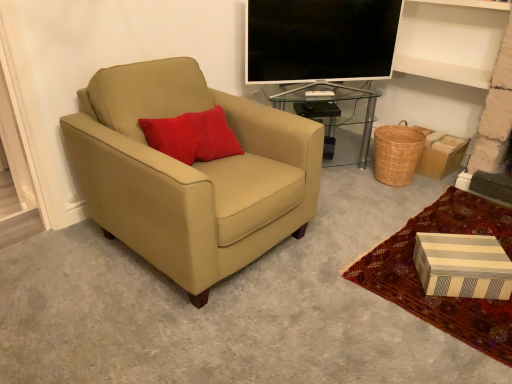
Question: Is flat screen tv at upper center positioned with its back to transparent glass table at center?

Choices:
 (A) no
 (B) yes

Answer: (A)

Question: From the image's perspective, is flat screen tv at upper center over transparent glass table at center?

Choices:
 (A) no
 (B) yes

Answer: (B)

Question: Considering the relative positions of flat screen tv at upper center and transparent glass table at center in the image provided, is flat screen tv at upper center to the right of transparent glass table at center from the viewer's perspective?

Choices:
 (A) yes
 (B) no

Answer: (A)

Question: Would you say flat screen tv at upper center contains transparent glass table at center?

Choices:
 (A) no
 (B) yes

Answer: (A)

Question: Considering the relative positions of flat screen tv at upper center and transparent glass table at center in the image provided, is flat screen tv at upper center to the left of transparent glass table at center from the viewer's perspective?

Choices:
 (A) no
 (B) yes

Answer: (A)

Question: Is flat screen tv at upper center taller or shorter than striped cardboard box at lower right?

Choices:
 (A) short
 (B) tall

Answer: (B)

Question: In terms of width, does flat screen tv at upper center look wider or thinner when compared to striped cardboard box at lower right?

Choices:
 (A) thin
 (B) wide

Answer: (A)

Question: From a real-world perspective, is flat screen tv at upper center physically located above or below striped cardboard box at lower right?

Choices:
 (A) below
 (B) above

Answer: (B)

Question: From the image's perspective, relative to striped cardboard box at lower right, is flat screen tv at upper center above or below?

Choices:
 (A) above
 (B) below

Answer: (A)

Question: In the image, is transparent glass table at center positioned in front of or behind striped cardboard box at lower right?

Choices:
 (A) front
 (B) behind

Answer: (B)

Question: Is transparent glass table at center taller or shorter than striped cardboard box at lower right?

Choices:
 (A) tall
 (B) short

Answer: (A)

Question: From the image's perspective, is transparent glass table at center above or below striped cardboard box at lower right?

Choices:
 (A) below
 (B) above

Answer: (B)

Question: Looking at the image, does transparent glass table at center seem bigger or smaller compared to striped cardboard box at lower right?

Choices:
 (A) small
 (B) big

Answer: (B)

Question: From a real-world perspective, is flat screen tv at upper center above or below woven brown basket at lower right?

Choices:
 (A) below
 (B) above

Answer: (B)

Question: Looking at their shapes, would you say flat screen tv at upper center is wider or thinner than woven brown basket at lower right?

Choices:
 (A) wide
 (B) thin

Answer: (B)